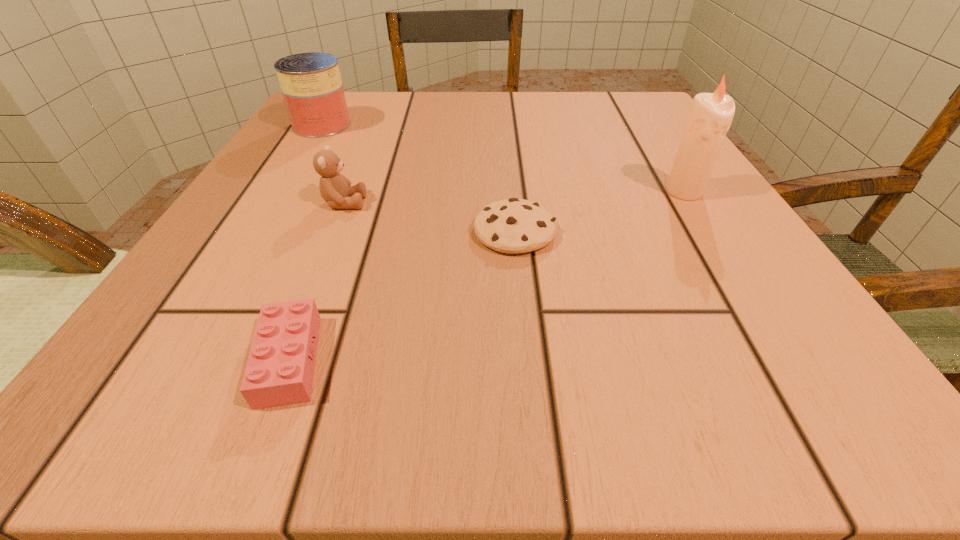
Locate an element on the screen. vacant space at the far edge of the desktop is located at coordinates (417, 126).

In order to click on free space at the near edge of the desktop in this screenshot , I will do `click(487, 401)`.

Find the location of a particular element. vacant region at the left edge of the desktop is located at coordinates (346, 164).

In the image, there is a desktop. Where is `vacant region at the right edge`? The image size is (960, 540). vacant region at the right edge is located at coordinates (756, 262).

Locate an element on the screen. free space at the far right corner is located at coordinates (622, 109).

The width and height of the screenshot is (960, 540). Identify the location of blank space at the near right corner of the desktop. (748, 364).

Find the location of a particular element. empty space between the second object from right to left and the teddy bear is located at coordinates (429, 217).

I want to click on blank region between the Lego and the leftmost object, so (x=305, y=242).

At what (x,y) coordinates should I click in order to perform the action: click on free space between the second object from right to left and the leftmost object. Please return your answer as a coordinate pair (x, y). This screenshot has width=960, height=540. Looking at the image, I should click on (419, 178).

Identify the location of free space between the third tallest object and the cookie. (429, 217).